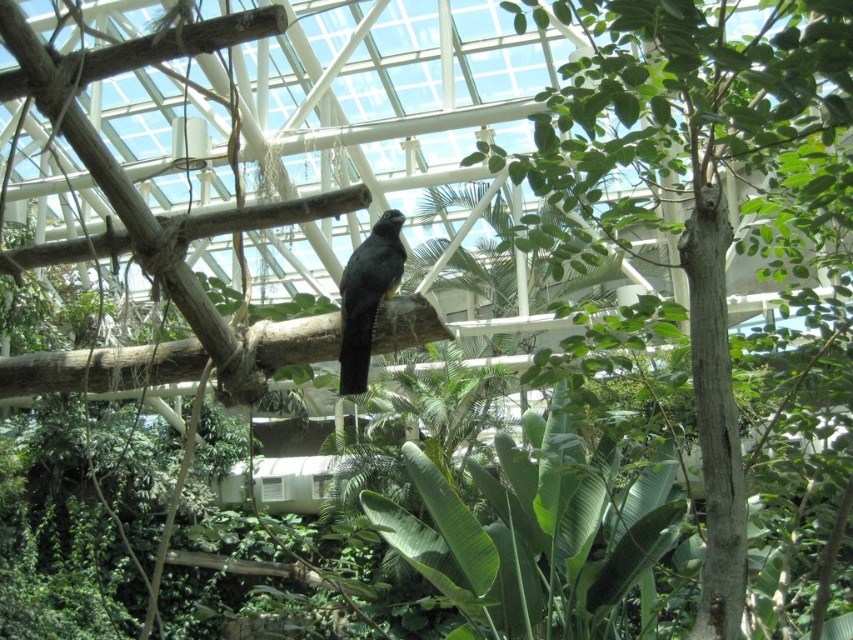
Measure the distance between green rough bark tree at center and camera.

They are 7.67 feet apart.

Is green rough bark tree at center taller than black glossy bird at center?

Correct, green rough bark tree at center is much taller as black glossy bird at center.

Is point (666, 120) positioned behind point (393, 218)?

No.

At what (x,y) coordinates should I click in order to perform the action: click on green rough bark tree at center. Please return your answer as a coordinate pair (x, y). The image size is (853, 640). Looking at the image, I should click on (706, 184).